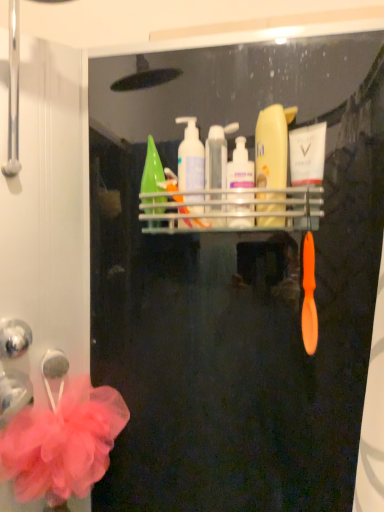
Question: From the image's perspective, is white glossy mouthwash at upper center, which is the second mouthwash from left to right, located above or below translucent plastic mouthwash at center, marked as the 1th mouthwash in a left-to-right arrangement?

Choices:
 (A) below
 (B) above

Answer: (B)

Question: Considering the positions of point (311, 150) and point (225, 140), is point (311, 150) closer or farther from the camera than point (225, 140)?

Choices:
 (A) farther
 (B) closer

Answer: (B)

Question: Which is nearer to the white glossy mouthwash at upper center, which is the second mouthwash from left to right?

Choices:
 (A) pink mesh flower at lower left
 (B) translucent plastic mouthwash at center, the second mouthwash from the right
 (C) matte yellow bottle at center, marked as the 4th cleaning product in a left-to-right arrangement
 (D) translucent plastic pump bottle at center, which ranks as the second cleaning product in right-to-left order
 (E) translucent plastic pump bottle at upper center, the 3th cleaning product positioned from the right

Answer: (C)

Question: Which object is positioned closest to the pink mesh flower at lower left?

Choices:
 (A) translucent plastic mouthwash at center, the second mouthwash from the right
 (B) green matte bottle at center, positioned as the fourth cleaning product in right-to-left order
 (C) translucent plastic pump bottle at center, marked as the third cleaning product in a left-to-right arrangement
 (D) translucent plastic pump bottle at upper center, the 3th cleaning product positioned from the right
 (E) white glossy mouthwash at upper center, the first mouthwash from the right

Answer: (B)